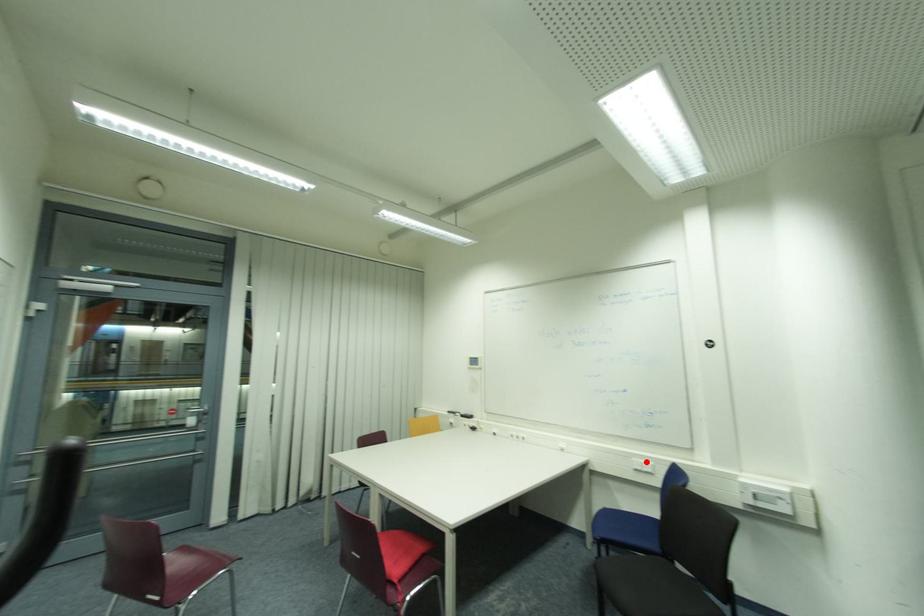
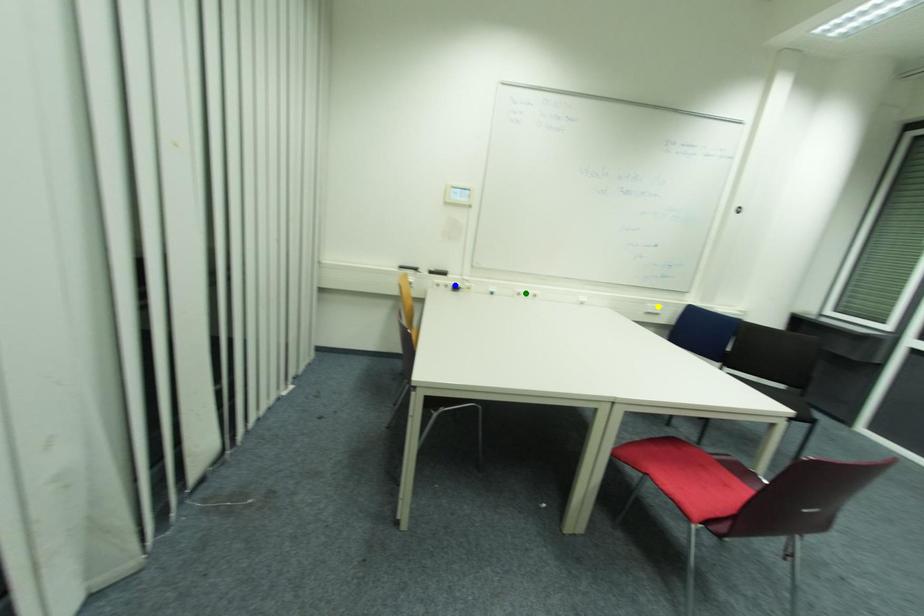
Question: I am providing you with two images of the same scene from different viewpoints. A red point is marked on the first image. You are given multiple points on the second image. Which spot in image 2 lines up with the point in image 1?

Choices:
 (A) blue point
 (B) yellow point
 (C) green point

Answer: (B)